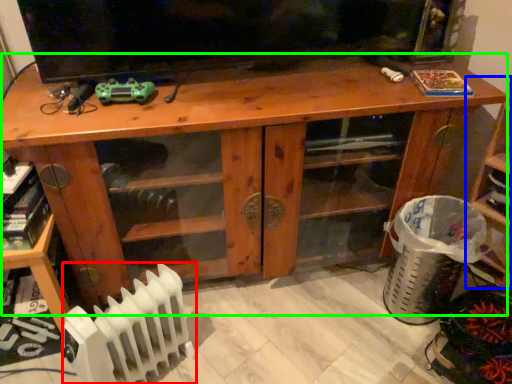
Question: Estimate the real-world distances between objects in this image. Which object is farther from radiator (highlighted by a red box), shelf (highlighted by a blue box) or desk (highlighted by a green box)?

Choices:
 (A) shelf
 (B) desk

Answer: (A)